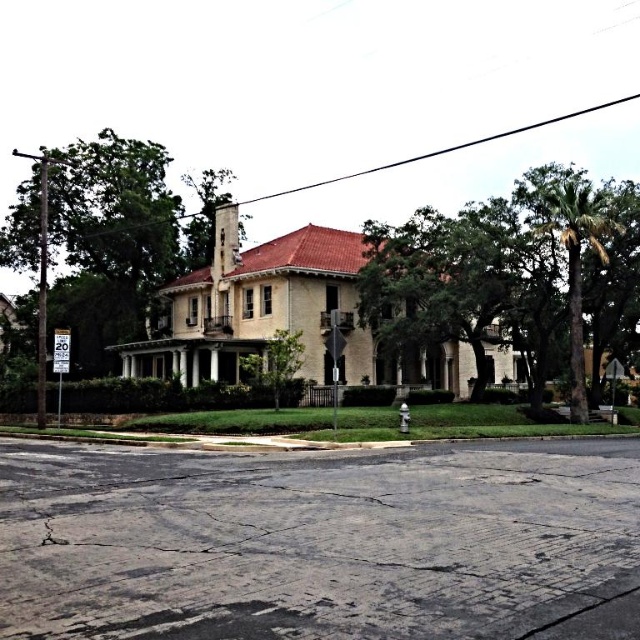
You are a landscape architect designing a pathway between the green leafy tree at right and the green leafy tree at left. Which tree requires a narrower pathway because of its smaller size?

The green leafy tree at right has a lesser width compared to the green leafy tree at left, so the pathway between them can be narrower near the green leafy tree at right due to its smaller size.

You are standing at point (x=275, y=362) in the image. What object is located exactly at this point?

The green leafy tree at center is located exactly at point (x=275, y=362).

You are a delivery person trying to navigate to the house. You see the green leafy tree at right and the white plastic speed limit sign at upper left. The distance between them is crucial for your route planning. Can you estimate how far apart these two landmarks are?

The green leafy tree at right and the white plastic speed limit sign at upper left are 75.28 feet apart from each other.